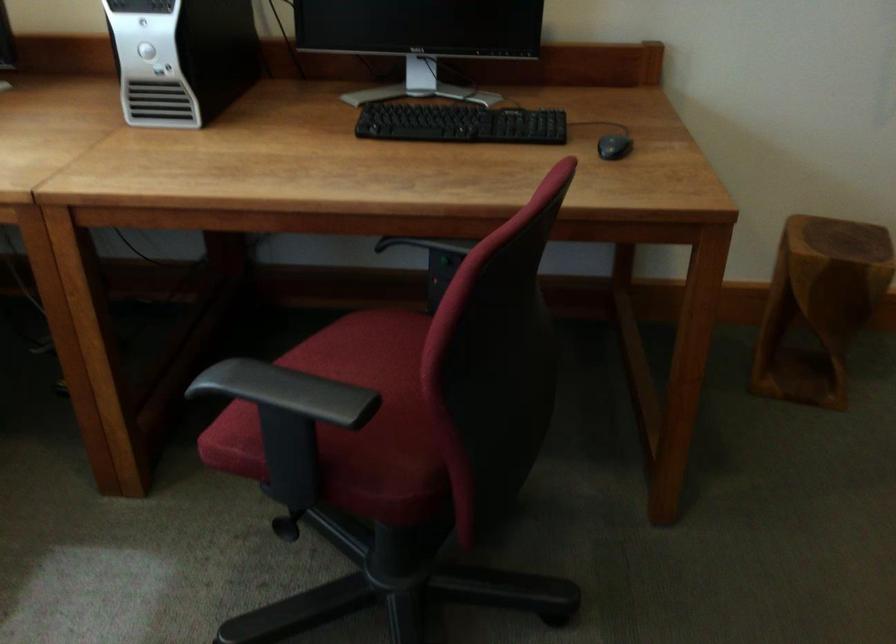
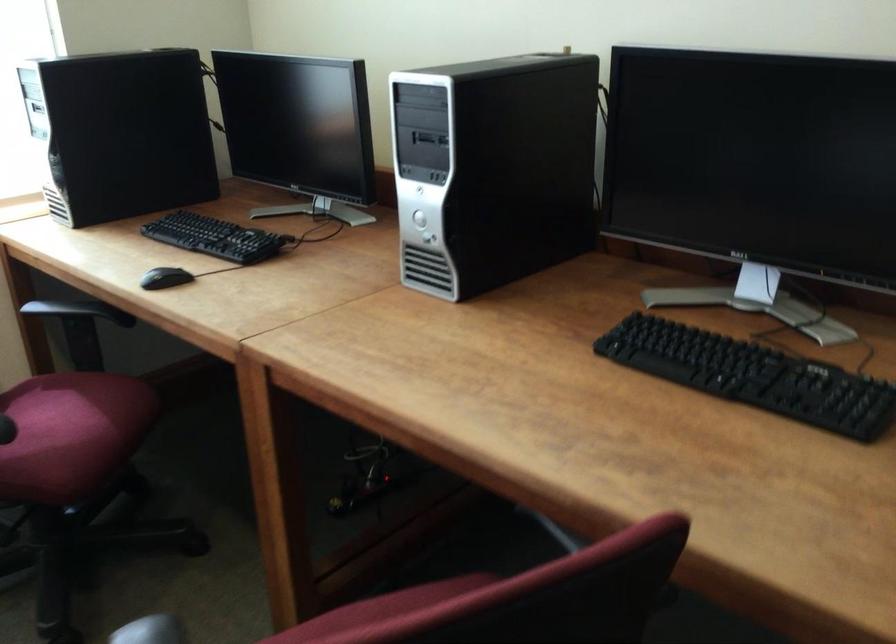
Question: The camera is either moving clockwise (left) or counter-clockwise (right) around the object. The first image is from the beginning of the video and the second image is from the end. Is the camera moving left or right when shooting the video?

Choices:
 (A) Left
 (B) Right

Answer: (B)